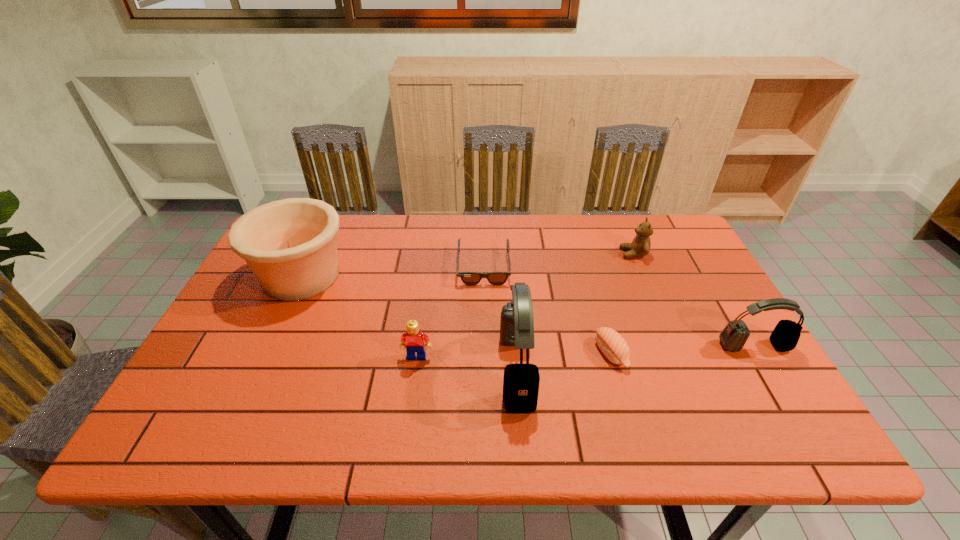
The width and height of the screenshot is (960, 540). I want to click on object at the far right corner, so click(640, 246).

This screenshot has width=960, height=540. I want to click on free space at the far edge, so click(371, 245).

Locate an element on the screen. vacant area at the near edge of the desktop is located at coordinates (324, 402).

Where is `free space at the far right corner of the desktop`? Image resolution: width=960 pixels, height=540 pixels. free space at the far right corner of the desktop is located at coordinates click(x=651, y=221).

In order to click on free space at the near right corner in this screenshot , I will do `click(768, 398)`.

Identify the location of empty space between the sushi and the teddy bear. (622, 303).

Identify the location of free area in between the sixth tallest object and the right headset. This screenshot has height=540, width=960. tap(683, 349).

Locate an element on the screen. This screenshot has height=540, width=960. vacant region between the left headset and the second shortest object is located at coordinates (564, 361).

At what (x,y) coordinates should I click in order to perform the action: click on empty space between the pottery and the second object from right to left. Please return your answer as a coordinate pair (x, y). Looking at the image, I should click on (468, 265).

Where is `free space that is in between the fifth object from left to right and the teddy bear`? The height and width of the screenshot is (540, 960). free space that is in between the fifth object from left to right and the teddy bear is located at coordinates (622, 303).